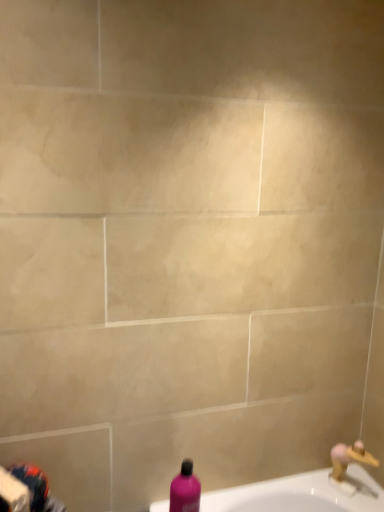
Question: From the image's perspective, is pink matte bottle at lower center above or below gold metallic faucet at lower right?

Choices:
 (A) below
 (B) above

Answer: (B)

Question: Does point (177, 489) appear closer or farther from the camera than point (365, 460)?

Choices:
 (A) farther
 (B) closer

Answer: (B)

Question: In the image, is pink matte bottle at lower center on the left side or the right side of gold metallic faucet at lower right?

Choices:
 (A) left
 (B) right

Answer: (A)

Question: From a real-world perspective, is gold metallic faucet at lower right physically located above or below pink matte bottle at lower center?

Choices:
 (A) above
 (B) below

Answer: (B)

Question: Considering their positions, is gold metallic faucet at lower right located in front of or behind pink matte bottle at lower center?

Choices:
 (A) behind
 (B) front

Answer: (A)

Question: Considering the positions of gold metallic faucet at lower right and pink matte bottle at lower center in the image, is gold metallic faucet at lower right taller or shorter than pink matte bottle at lower center?

Choices:
 (A) short
 (B) tall

Answer: (A)

Question: Is gold metallic faucet at lower right wider or thinner than pink matte bottle at lower center?

Choices:
 (A) wide
 (B) thin

Answer: (B)